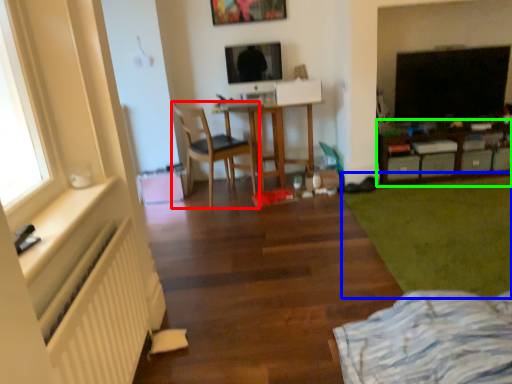
Question: Which object is the closest to the chair (highlighted by a red box)? Choose among these: grass (highlighted by a blue box) or table (highlighted by a green box).

Choices:
 (A) grass
 (B) table

Answer: (A)